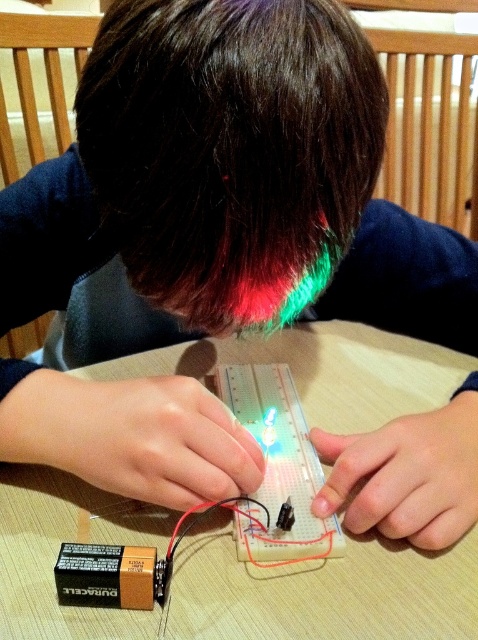
Can you confirm if dark brown hair at center is shorter than beige plastic table at center?

Answer: No, dark brown hair at center is not shorter than beige plastic table at center.

Is dark brown hair at center behind beige plastic table at center?

No, it is in front of beige plastic table at center.

Which is behind, point (202, 182) or point (21, 586)?

The point (21, 586) is more distant.

Where is `dark brown hair at center`? dark brown hair at center is located at coordinates (230, 150).